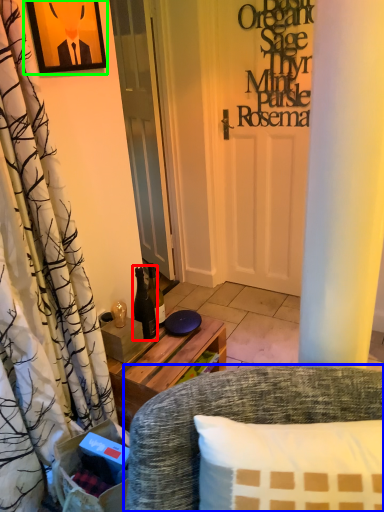
Question: Considering the real-world distances, which object is closest to bottle (highlighted by a red box)? chair (highlighted by a blue box) or picture frame (highlighted by a green box).

Choices:
 (A) chair
 (B) picture frame

Answer: (A)